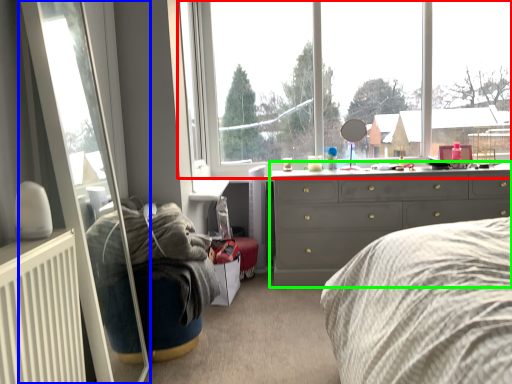
Question: Estimate the real-world distances between objects in this image. Which object is farther from window (highlighted by a red box), glass door (highlighted by a blue box) or chest of drawers (highlighted by a green box)?

Choices:
 (A) glass door
 (B) chest of drawers

Answer: (A)